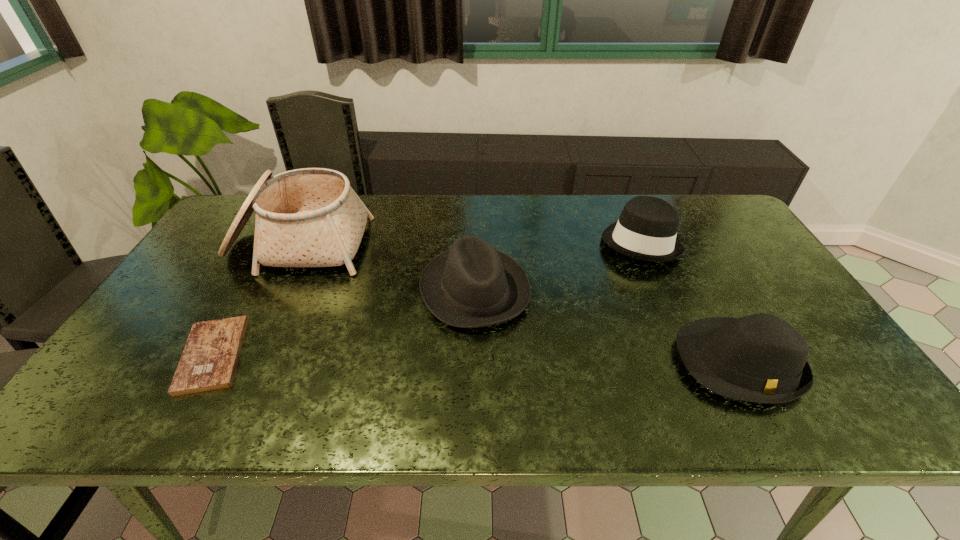
Where is `blank space at the far right corner of the desktop`? Image resolution: width=960 pixels, height=540 pixels. blank space at the far right corner of the desktop is located at coordinates (693, 202).

Locate an element on the screen. Image resolution: width=960 pixels, height=540 pixels. vacant area that lies between the leftmost fedora and the tallest object is located at coordinates (387, 267).

Image resolution: width=960 pixels, height=540 pixels. I want to click on vacant area that lies between the leftmost fedora and the Bible, so pos(344,322).

Identify which object is located as the fourth nearest to the leftmost fedora. Please provide its 2D coordinates. Your answer should be formatted as a tuple, i.e. [(x, y)], where the tuple contains the x and y coordinates of a point satisfying the conditions above.

[(209, 360)]

Choose which object is the third nearest neighbor to the Bible. Please provide its 2D coordinates. Your answer should be formatted as a tuple, i.e. [(x, y)], where the tuple contains the x and y coordinates of a point satisfying the conditions above.

[(646, 230)]

Select which fedora is the closest to the Bible. Please provide its 2D coordinates. Your answer should be formatted as a tuple, i.e. [(x, y)], where the tuple contains the x and y coordinates of a point satisfying the conditions above.

[(472, 285)]

Identify the location of fedora identified as the third closest to the Bible. (761, 358).

Where is `vacant space that satisfies the following two spatial constraints: 1. with the lid open on the basket; 2. on the left side of the third object from left to right`? The image size is (960, 540). vacant space that satisfies the following two spatial constraints: 1. with the lid open on the basket; 2. on the left side of the third object from left to right is located at coordinates (276, 289).

Find the location of a particular element. vacant space that satisfies the following two spatial constraints: 1. on the back side of the third object from right to left; 2. on the left side of the Bible is located at coordinates [x=250, y=289].

I want to click on vacant space that satisfies the following two spatial constraints: 1. with the lid open on the basket; 2. on the right side of the third object from left to right, so click(x=276, y=289).